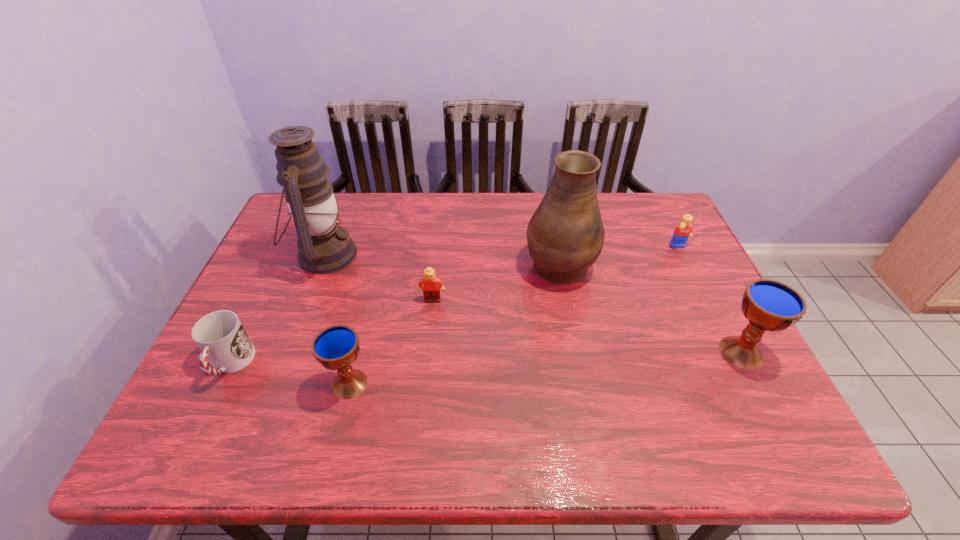
Where is `vacant space at the left edge of the desktop`? The image size is (960, 540). vacant space at the left edge of the desktop is located at coordinates (285, 259).

Find the location of a particular element. The image size is (960, 540). vacant space at the far right corner is located at coordinates (664, 211).

Where is `unoccupied position between the farther Lego and the left chalice`? unoccupied position between the farther Lego and the left chalice is located at coordinates (515, 316).

Where is `vacant point located between the third object from right to left and the right Lego`? The image size is (960, 540). vacant point located between the third object from right to left and the right Lego is located at coordinates (619, 255).

Where is `free space between the cup and the fourth shortest object`? This screenshot has width=960, height=540. free space between the cup and the fourth shortest object is located at coordinates (290, 374).

Where is `vacant area between the sixth shortest object and the farther Lego`? vacant area between the sixth shortest object and the farther Lego is located at coordinates (619, 255).

Locate an element on the screen. free space that is in between the second tallest object and the farther Lego is located at coordinates (619, 255).

Locate an element on the screen. free spot between the right Lego and the pitcher is located at coordinates (619, 255).

You are a GUI agent. You are given a task and a screenshot of the screen. Output one action in this format:
    pyautogui.click(x=<x>, y=<y>)
    Task: Click on the empty location between the oil lamp and the left Lego
    
    Given the screenshot: What is the action you would take?
    pyautogui.click(x=378, y=278)

Locate an element on the screen. The height and width of the screenshot is (540, 960). free space between the fifth object from right to left and the second tallest object is located at coordinates [x=454, y=323].